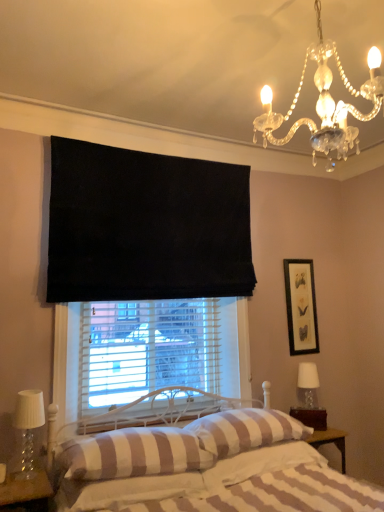
Question: Would you say black matte picture frame at upper right is to the left or to the right of striped fabric pillow at center, which appears as the 2th pillow when viewed from the left, in the picture?

Choices:
 (A) left
 (B) right

Answer: (B)

Question: From a real-world perspective, relative to striped fabric pillow at center, the 2th pillow positioned from the right, is black matte picture frame at upper right vertically above or below?

Choices:
 (A) below
 (B) above

Answer: (B)

Question: Based on their relative distances, which object is farther from the clear glass table lamp at right, positioned as the 2th table lamp in front-to-back order?

Choices:
 (A) white striped fabric bed at center
 (B) striped fabric pillow at lower center, which is the 3th pillow in right-to-left order
 (C) clear crystal chandelier at upper right
 (D) black matte picture frame at upper right
 (E) clear glass table lamp at lower left, acting as the second table lamp starting from the back

Answer: (C)

Question: Based on their relative distances, which object is nearer to the brown wooden nightstand at lower right?

Choices:
 (A) striped cotton sheet at lower center
 (B) white striped fabric bed at center
 (C) striped fabric pillow at lower center, acting as the first pillow starting from the left
 (D) striped fabric pillow at center, which is the 3th pillow in left-to-right order
 (E) striped fabric pillow at center, the 2th pillow positioned from the right

Answer: (E)